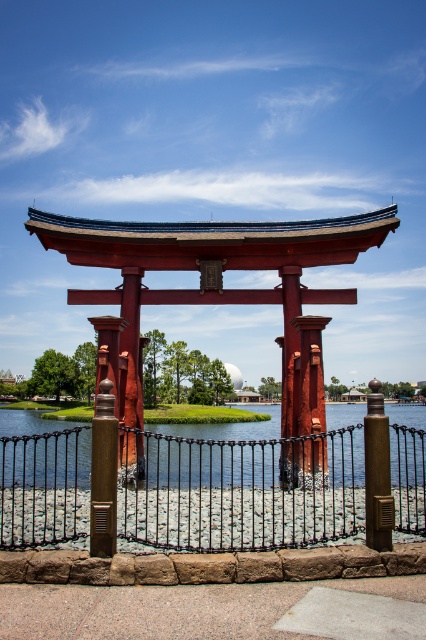
Can you confirm if black wrought iron fence at center is shorter than rustic wood pillar at center?

No.

Is point (253, 458) positioned in front of point (299, 316)?

No, (253, 458) is further to viewer.

Is point (389, 442) positioned in front of point (324, 458)?

Yes, it is.

Locate an element on the screen. Image resolution: width=426 pixels, height=640 pixels. black wrought iron fence at center is located at coordinates (238, 493).

Which is below, clear water at gate center or rustic wood pillar at center?

clear water at gate center is lower down.

Who is more distant from viewer, (x=77, y=432) or (x=293, y=460)?

Point (x=293, y=460)

Is point (201, 467) positioned after point (302, 364)?

Yes, it is behind point (302, 364).

Locate an element on the screen. clear water at gate center is located at coordinates (213, 460).

The height and width of the screenshot is (640, 426). In order to click on black wrought iron fence at center in this screenshot , I will do pos(238,493).

Where is `black wrought iron fence at center`? The image size is (426, 640). black wrought iron fence at center is located at coordinates (238, 493).